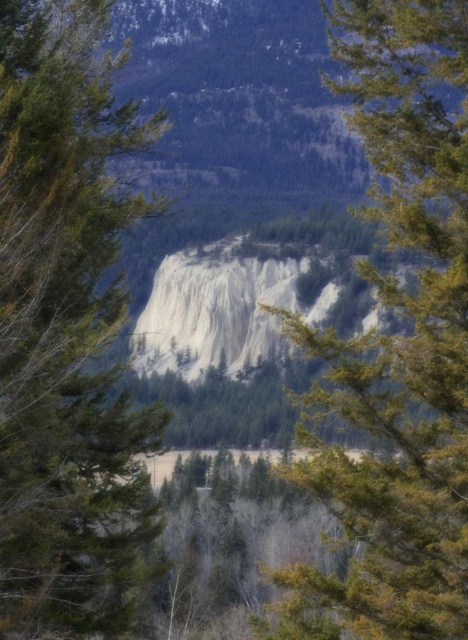
Question: Does green matte tree at center have a smaller size compared to green textured tree at center?

Choices:
 (A) no
 (B) yes

Answer: (B)

Question: Can you confirm if green matte tree at center is bigger than green textured tree at center?

Choices:
 (A) yes
 (B) no

Answer: (B)

Question: Observing the image, what is the correct spatial positioning of green matte tree at center in reference to green textured tree at center?

Choices:
 (A) left
 (B) right

Answer: (A)